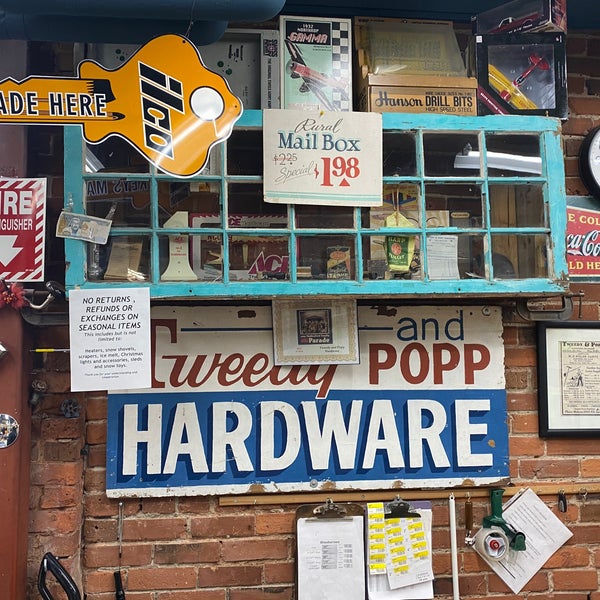
The image size is (600, 600). Identify the location of tape dispenser. (495, 515).